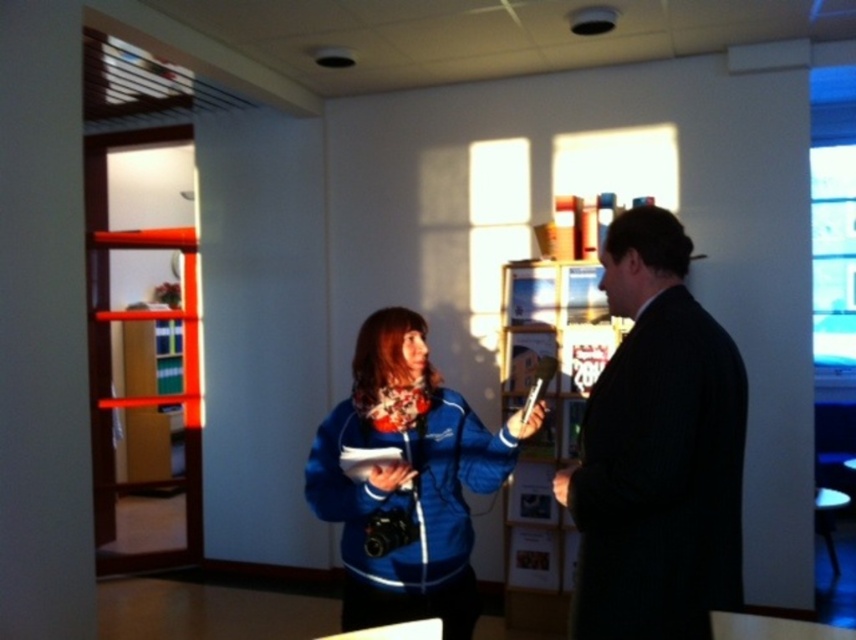
You are a tailor measuring the space between two jackets. The blue fabric jacket at center and the blue fleece jacket at center need to be placed on a rack that can only accommodate items spaced 4 inches apart. Can both jackets fit on the rack without overlapping?

The distance between the blue fabric jacket at center and the blue fleece jacket at center is 4.07 inches, which is slightly more than 4 inches. Therefore, they can just barely fit on the rack without overlapping.

You are a delivery person who needs to place a package between the dark suit at center and the wooden bookshelf at center. The package requires a space of 2 meters. Is there enough space between them?

The dark suit at center is 1.94 meters from the wooden bookshelf at center. Since the required space is 2 meters, there isn not enough space between them to place the package.

You are standing in the room and want to place a new painting on the wall. The painting is 1 meter wide. The blue fleece jacket at center is located at point 0.752 on the horizontal axis and 0.475 on the vertical axis. If the wall is 3 meters wide, can you hang the painting so that it doesn

The blue fleece jacket at center is located at point 0.752 on the horizontal axis. Since the wall is 3 meters wide, the jacket is positioned 2.256 meters from the left edge. The painting is 1 meter wide, so if you place it starting at 1.256 meters from the left edge, it will extend from 1.256 to 2.256 meters, overlapping the jacket. To avoid overlap, position the painting either from 0 to 1 meter on the left or from 2.256 to 3 meters on the right.